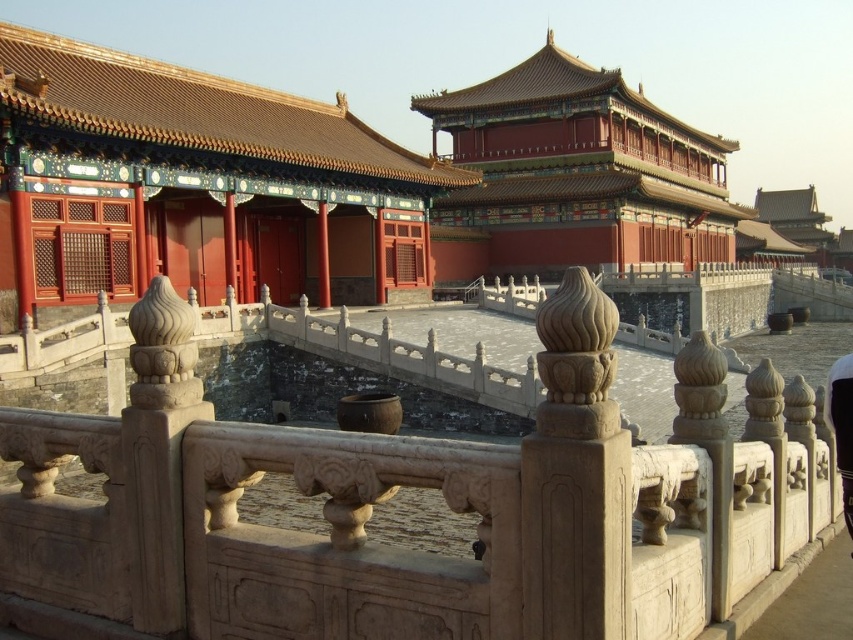
You are an architect visiting the Forbidden City and see the matte red wood palace at center and the red lacquered wood palace at upper center. Which palace appears larger in the image?

The red lacquered wood palace at upper center appears larger than the matte red wood palace at center.